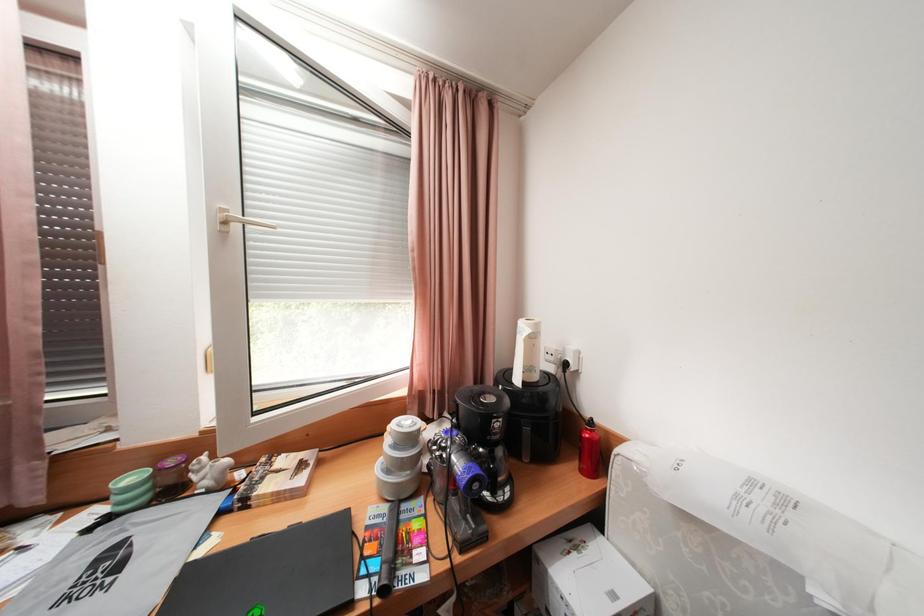
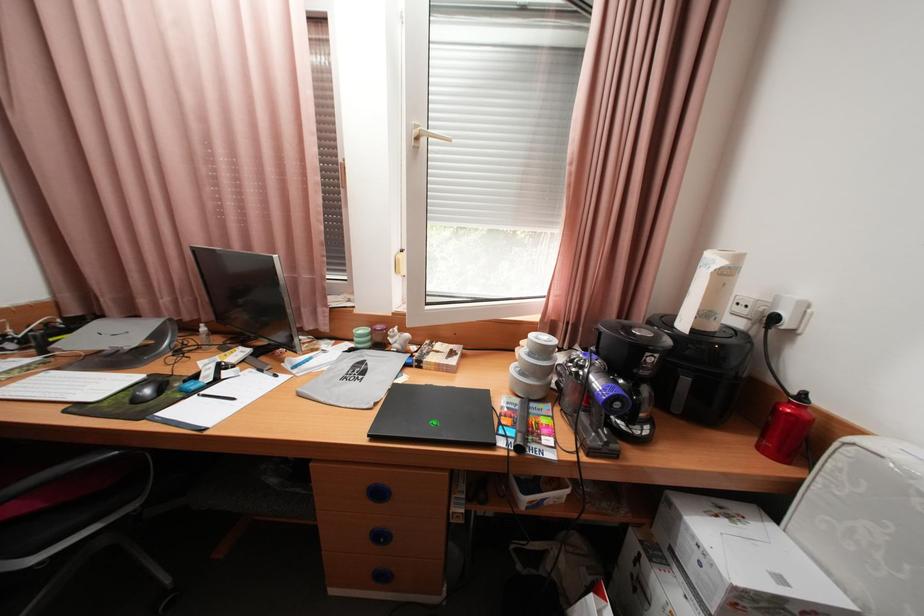
Question: The first image is from the beginning of the video and the second image is from the end. How did the camera likely rotate when shooting the video?

Choices:
 (A) Left
 (B) Right
 (C) Up
 (D) Down

Answer: (A)